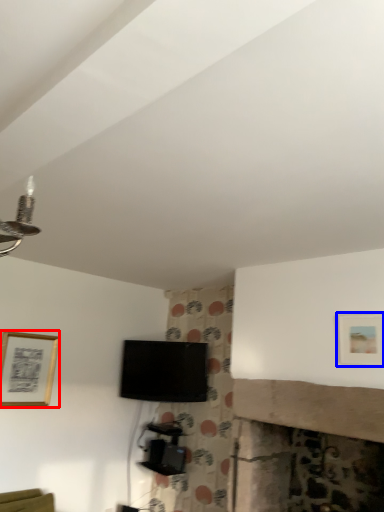
Question: Among these objects, which one is farthest to the camera, picture frame (highlighted by a red box) or picture frame (highlighted by a blue box)?

Choices:
 (A) picture frame
 (B) picture frame

Answer: (A)